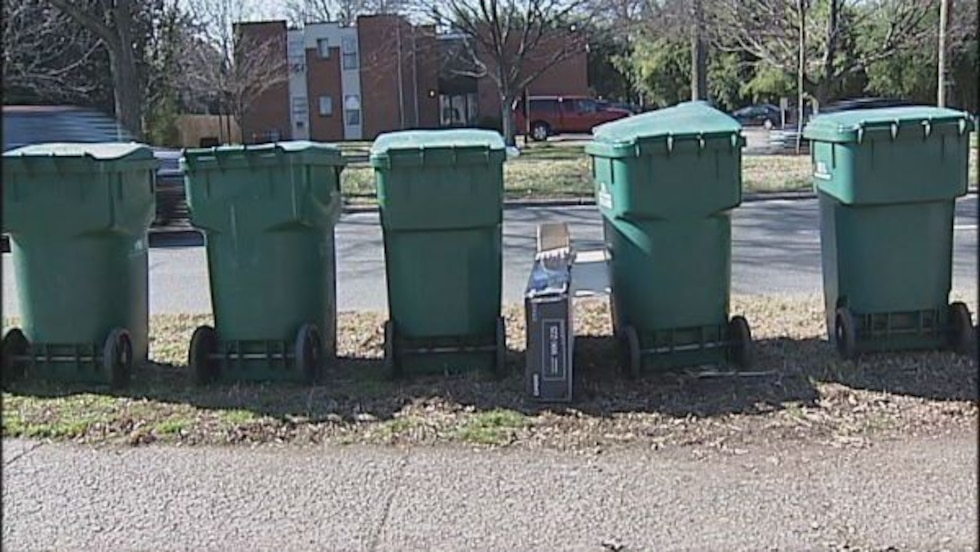
This screenshot has width=980, height=552. Find the location of `windows`. windows is located at coordinates (299, 51), (348, 52), (300, 105), (326, 47), (326, 108), (353, 110).